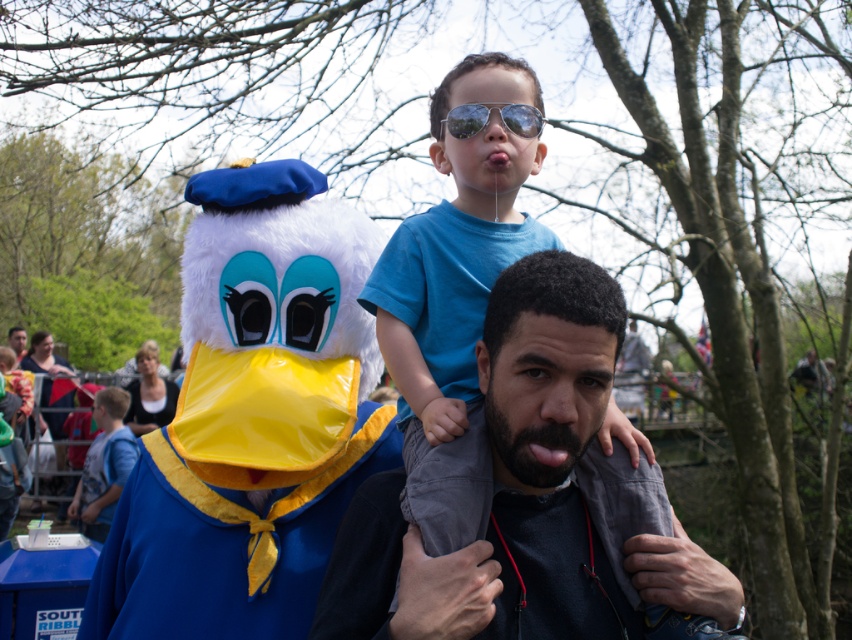
You are a photographer at the event and need to capture a clear photo of the reflective plastic goggles at center without the dark gray fabric at center blocking it. Can you adjust your angle to do so?

The dark gray fabric at center has a larger size compared to reflective plastic goggles at center, so it might block the view. However, by adjusting the camera angle slightly downward or sideways, you can position the smaller reflective plastic goggles at center in a way that avoids the larger dark gray fabric at center obstruction.